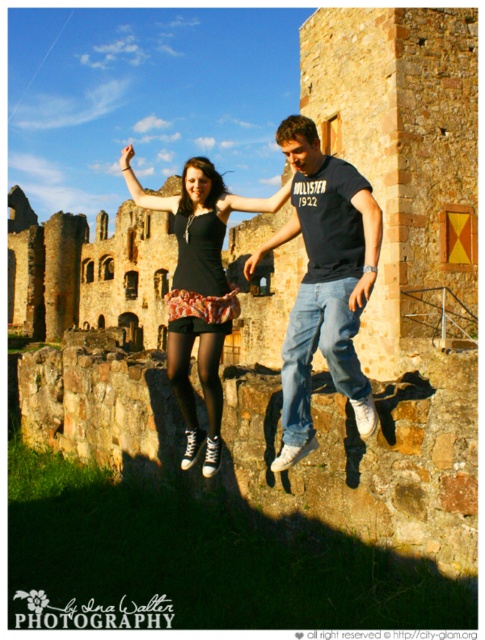
Which is in front, point (297, 147) or point (210, 339)?

Positioned in front is point (297, 147).

Can you confirm if matte black t-shirt at center is wider than matte black dress at center?

In fact, matte black t-shirt at center might be narrower than matte black dress at center.

You are a GUI agent. You are given a task and a screenshot of the screen. Output one action in this format:
    pyautogui.click(x=<x>, y=<y>)
    Task: Click on the matte black t-shirt at center
    The width and height of the screenshot is (485, 640).
    Given the screenshot: What is the action you would take?
    pyautogui.click(x=323, y=282)

Locate an element on the screen. The width and height of the screenshot is (485, 640). matte black t-shirt at center is located at coordinates (323, 282).